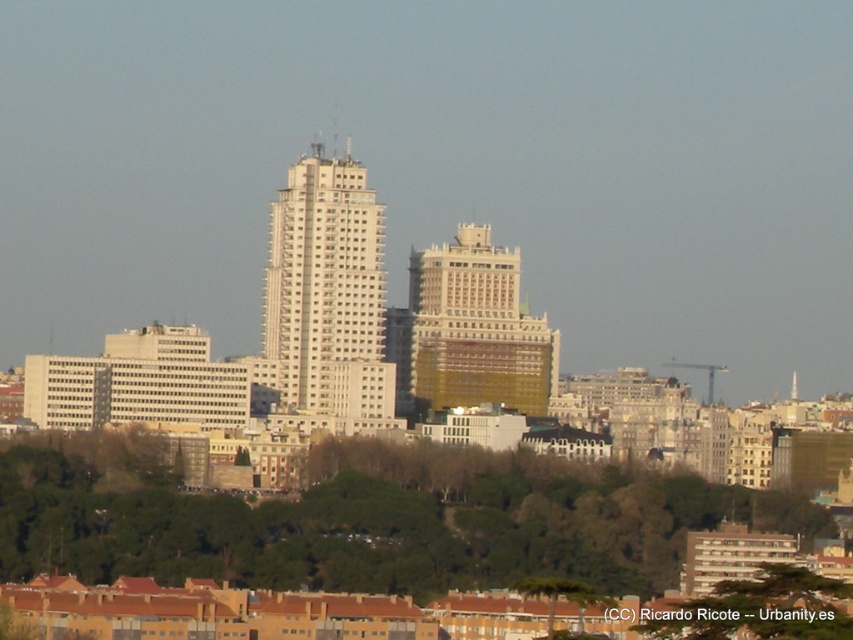
Question: Is green leafy trees at lower center wider than white smooth building at center?

Choices:
 (A) yes
 (B) no

Answer: (A)

Question: Can you confirm if white smooth building at center is positioned to the left of gold textured building at center?

Choices:
 (A) no
 (B) yes

Answer: (B)

Question: Which object appears closest to the camera in this image?

Choices:
 (A) green leafy tree at lower center
 (B) green leafy tree at center

Answer: (B)

Question: Which point is closer to the camera taking this photo?

Choices:
 (A) (576, 598)
 (B) (747, 636)
 (C) (320, 236)
 (D) (349, 483)

Answer: (C)

Question: Among these points, which one is nearest to the camera?

Choices:
 (A) (583, 595)
 (B) (281, 326)

Answer: (B)

Question: Where is white smooth building at center located in relation to green leafy tree at lower center in the image?

Choices:
 (A) above
 (B) below

Answer: (A)